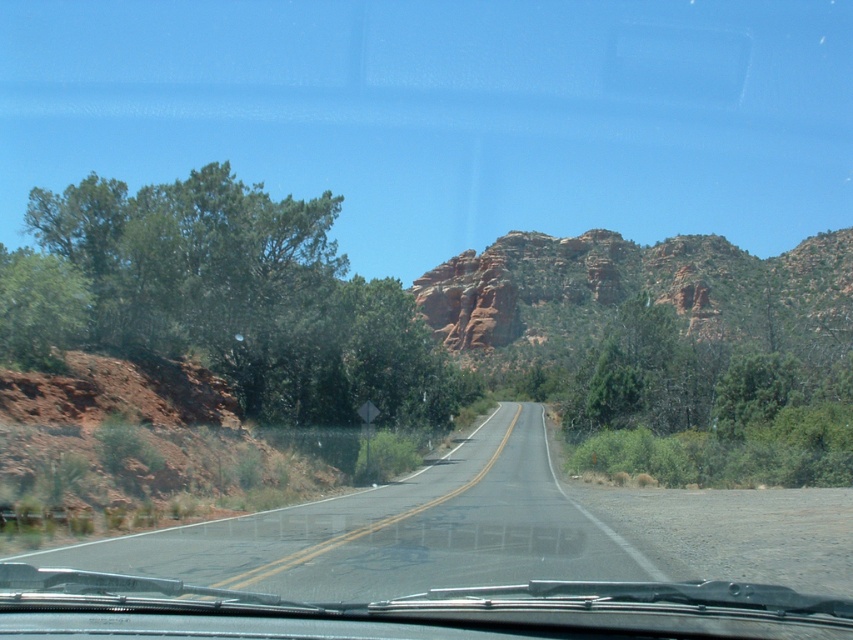
Is asphalt road at center above reddish-brown rock formation at center?

Incorrect, asphalt road at center is not positioned above reddish-brown rock formation at center.

Which is below, asphalt road at center or reddish-brown rock formation at center?

asphalt road at center is below.

Does point (409, 502) come farther from viewer compared to point (831, 280)?

No, (409, 502) is closer to viewer.

You are a GUI agent. You are given a task and a screenshot of the screen. Output one action in this format:
    pyautogui.click(x=<x>, y=<y>)
    Task: Click on the asphalt road at center
    
    Given the screenshot: What is the action you would take?
    pyautogui.click(x=393, y=531)